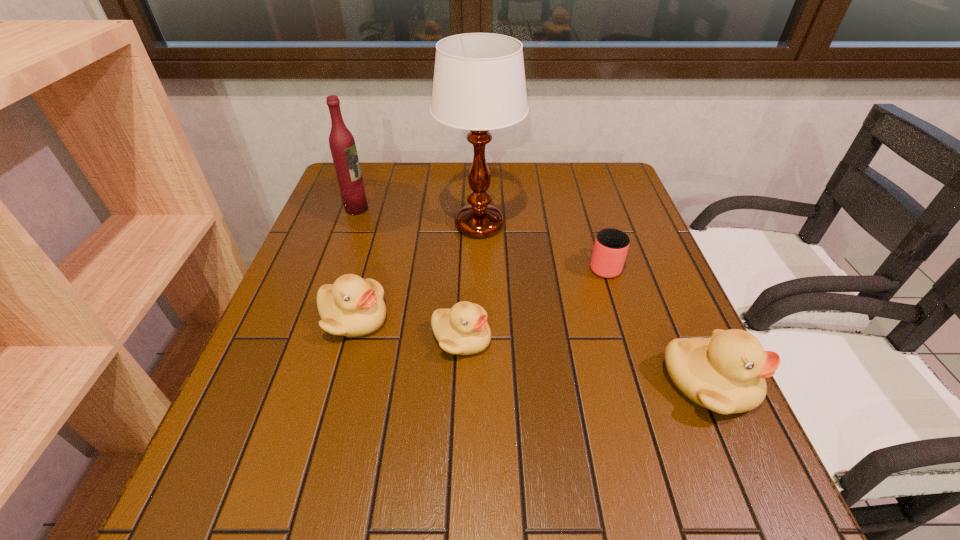
Find the location of `vacant space located on the back of the table lamp`. vacant space located on the back of the table lamp is located at coordinates (480, 176).

Identify the location of vacant position located 0.380m on the handle side of the cup. (576, 175).

Locate an element on the screen. This screenshot has width=960, height=540. vacant space located on the handle side of the cup is located at coordinates (579, 183).

Where is `vacant area located 0.090m on the handle side of the cup`? vacant area located 0.090m on the handle side of the cup is located at coordinates (593, 230).

Locate an element on the screen. Image resolution: width=960 pixels, height=540 pixels. liquor present at the far edge is located at coordinates (342, 144).

Identify the location of table lamp at the far edge. (479, 84).

This screenshot has width=960, height=540. I want to click on object that is at the near edge, so click(725, 373).

Identify the location of duckling located in the left edge section of the desktop. This screenshot has width=960, height=540. (352, 306).

The height and width of the screenshot is (540, 960). What are the coordinates of `liquor present at the left edge` in the screenshot? It's located at (342, 144).

Identify the location of duckling that is at the right edge. Image resolution: width=960 pixels, height=540 pixels. (725, 373).